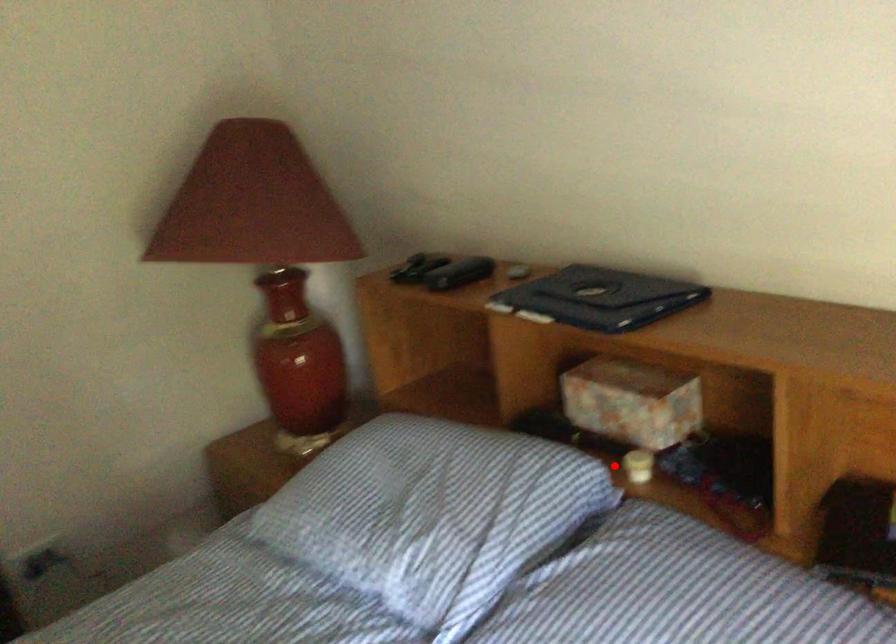
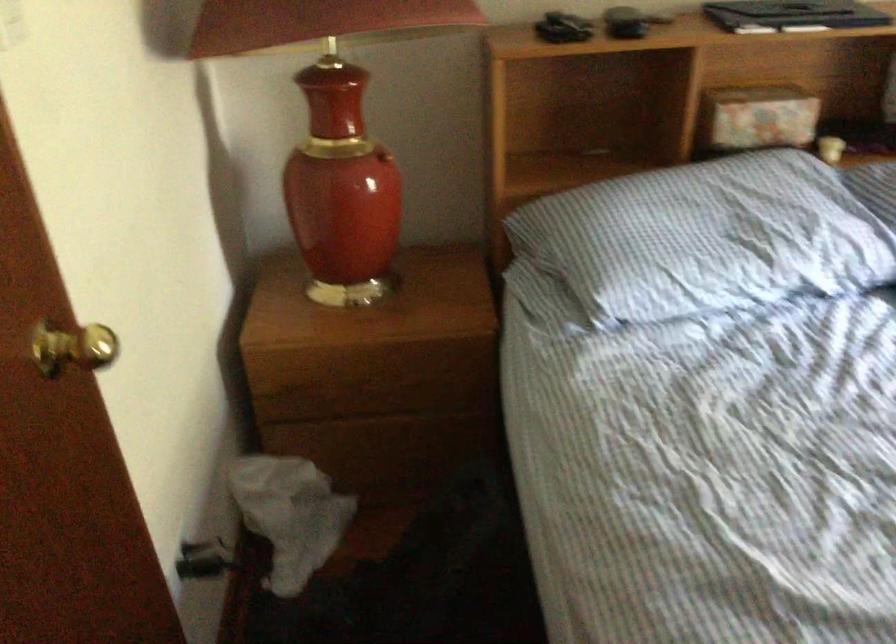
Question: I am providing you with two images of the same scene from different viewpoints. A red point is shown in image1. For the corresponding object point in image2, is it positioned nearer or farther from the camera?

Choices:
 (A) Nearer
 (B) Farther

Answer: (B)